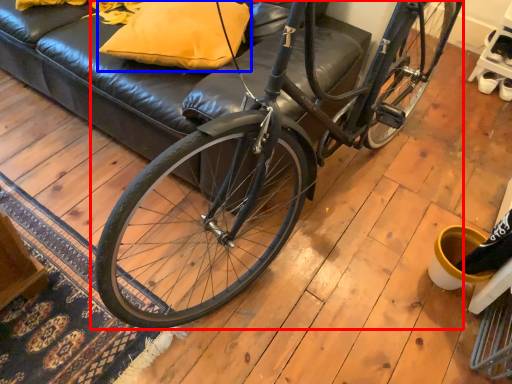
Question: Which object is further to the camera taking this photo, bicycle (highlighted by a red box) or pillow (highlighted by a blue box)?

Choices:
 (A) bicycle
 (B) pillow

Answer: (B)